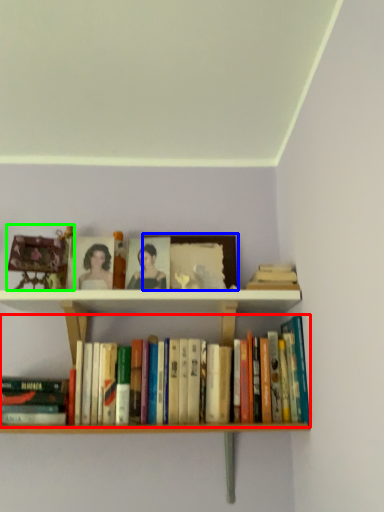
Question: Estimate the real-world distances between objects in this image. Which object is closer to book (highlighted by a red box), picture frame (highlighted by a blue box) or toy (highlighted by a green box)?

Choices:
 (A) picture frame
 (B) toy

Answer: (B)